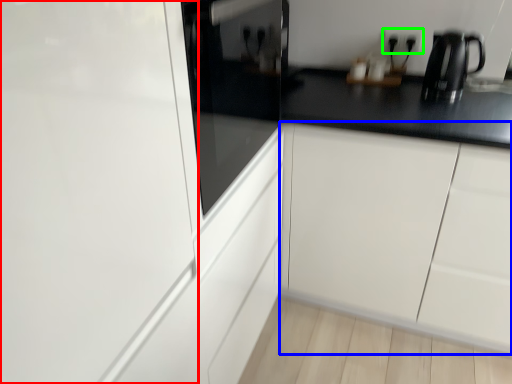
Question: Which is nearer to the glass door (highlighted by a red box)? cabinetry (highlighted by a blue box) or electric outlet (highlighted by a green box).

Choices:
 (A) cabinetry
 (B) electric outlet

Answer: (A)